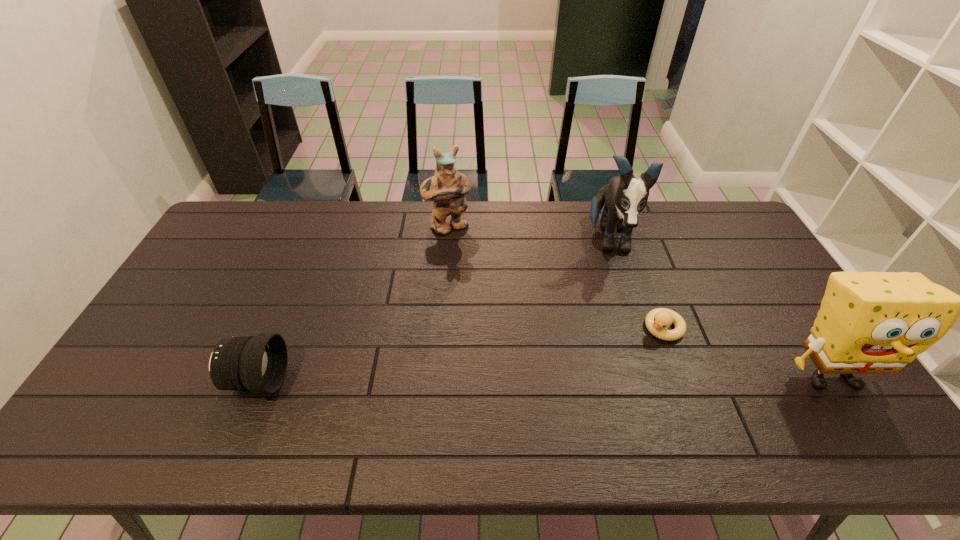
Locate an element on the screen. sponge at the near edge is located at coordinates (869, 322).

Image resolution: width=960 pixels, height=540 pixels. I want to click on object that is at the right edge, so click(869, 322).

Where is `object present at the near right corner`? Image resolution: width=960 pixels, height=540 pixels. object present at the near right corner is located at coordinates (869, 322).

In the image, there is a desktop. Where is `vacant space at the far edge`? This screenshot has width=960, height=540. vacant space at the far edge is located at coordinates (424, 239).

At what (x,y) coordinates should I click in order to perform the action: click on vacant space at the near edge of the desktop. Please return your answer as a coordinate pair (x, y). The width and height of the screenshot is (960, 540). Looking at the image, I should click on (680, 397).

Where is `vacant space at the left edge of the desktop`? This screenshot has width=960, height=540. vacant space at the left edge of the desktop is located at coordinates click(161, 362).

Locate an element on the screen. This screenshot has width=960, height=540. vacant space at the right edge of the desktop is located at coordinates (791, 312).

The image size is (960, 540). Identify the location of vacant space at the far left corner of the desktop. (249, 235).

The height and width of the screenshot is (540, 960). In order to click on empty space that is in between the shortest object and the sponge in this screenshot , I will do `click(747, 352)`.

In order to click on vacant space in between the sponge and the shortest object in this screenshot , I will do `click(747, 352)`.